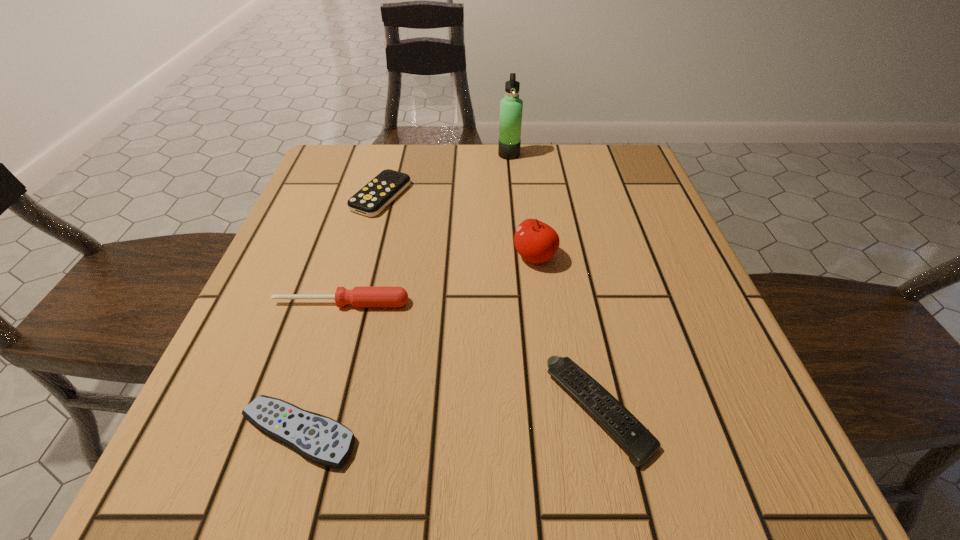
Identify the location of object present at the near left corner. The width and height of the screenshot is (960, 540). (318, 438).

The image size is (960, 540). I want to click on object at the near right corner, so click(636, 440).

Where is `vacant region at the far edge of the desktop`? This screenshot has width=960, height=540. vacant region at the far edge of the desktop is located at coordinates (391, 158).

Where is `vacant point at the left edge`? vacant point at the left edge is located at coordinates (296, 217).

Locate an element on the screen. vacant space at the right edge is located at coordinates (686, 301).

Find the location of a particular element. The height and width of the screenshot is (540, 960). vacant region at the far left corner of the desktop is located at coordinates (371, 177).

In the image, there is a desktop. What are the coordinates of `blank space at the near left corner` in the screenshot? It's located at (220, 448).

The height and width of the screenshot is (540, 960). Find the location of `vacant space that's between the fourth shortest object and the farthest remote control`. vacant space that's between the fourth shortest object and the farthest remote control is located at coordinates (361, 249).

The height and width of the screenshot is (540, 960). Find the location of `vacant area that lies between the fourth shortest object and the farthest object`. vacant area that lies between the fourth shortest object and the farthest object is located at coordinates (425, 229).

Locate an element on the screen. The height and width of the screenshot is (540, 960). blank region between the apple and the farthest remote control is located at coordinates (458, 226).